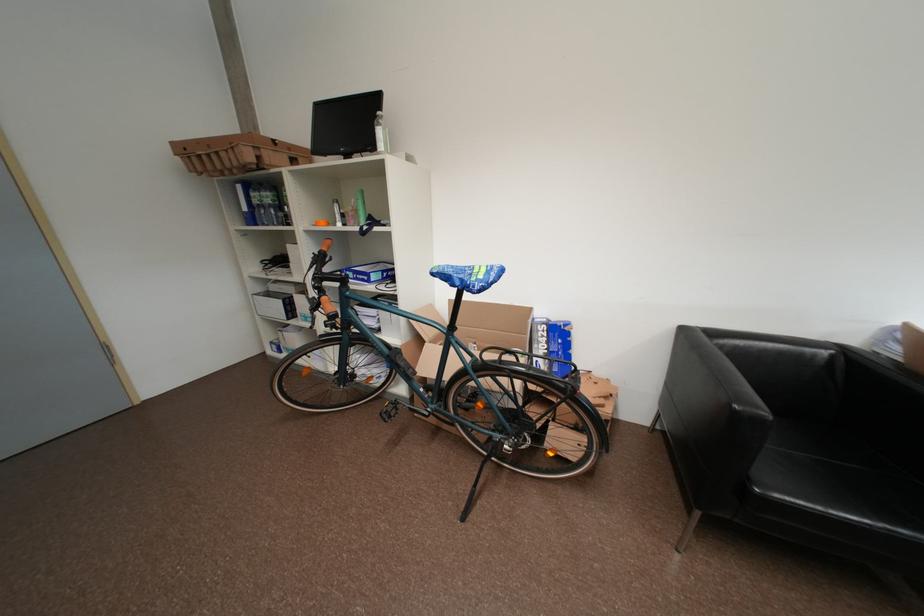
The location [381,134] corresponds to which object?

This point indicates the plastic water bottle.